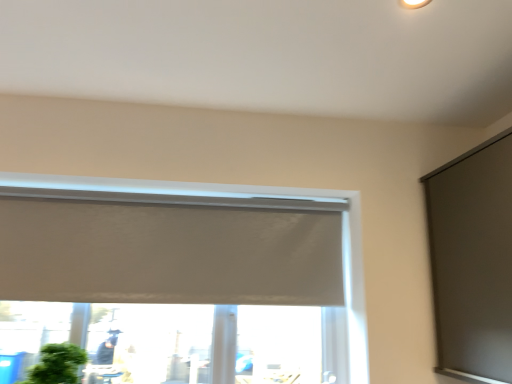
This screenshot has width=512, height=384. Identify the location of green matte houseplant at lower left. (57, 364).

The width and height of the screenshot is (512, 384). What do you see at coordinates (473, 261) in the screenshot?
I see `matte gray screen at right` at bounding box center [473, 261].

Locate an element on the screen. Image resolution: width=512 pixels, height=384 pixels. matte gray screen at right is located at coordinates (473, 261).

This screenshot has width=512, height=384. What are the coordinates of `green matte houseplant at lower left` in the screenshot? It's located at (57, 364).

From a real-world perspective, is matte gray screen at right on green matte houseplant at lower left?

Yes, from a real-world perspective, matte gray screen at right is on top of green matte houseplant at lower left.

Is there a large distance between matte gray screen at right and green matte houseplant at lower left?

Absolutely, matte gray screen at right is distant from green matte houseplant at lower left.

There is a green matte houseplant at lower left. Where is `window screen above it (from a real-world perspective)`? Image resolution: width=512 pixels, height=384 pixels. window screen above it (from a real-world perspective) is located at coordinates (473, 261).

From the image's perspective, is matte gray screen at right below green matte houseplant at lower left?

No, from the image's perspective, matte gray screen at right is not beneath green matte houseplant at lower left.

Which is farther, (52, 371) or (347, 251)?

The point (347, 251) is behind.

Is green matte houseplant at lower left looking in the opposite direction of white matte window at center?

Absolutely, green matte houseplant at lower left is directed away from white matte window at center.

Is green matte houseplant at lower left with white matte window at center?

No, green matte houseplant at lower left is not next to white matte window at center.

Is green matte houseplant at lower left taller than white matte window at center?

No.

Is green matte houseplant at lower left next to matte gray screen at right?

No, green matte houseplant at lower left is not making contact with matte gray screen at right.

Can you confirm if green matte houseplant at lower left is thinner than matte gray screen at right?

Yes, green matte houseplant at lower left is thinner than matte gray screen at right.

Is green matte houseplant at lower left oriented towards matte gray screen at right?

No, green matte houseplant at lower left is not turned towards matte gray screen at right.

How many degrees apart are the facing directions of matte gray screen at right and white matte window at center?

The angle between the facing direction of matte gray screen at right and the facing direction of white matte window at center is 91.5 degrees.

Which is behind, matte gray screen at right or white matte window at center?

white matte window at center is further from the camera.

Which object is positioned more to the right, matte gray screen at right or white matte window at center?

From the viewer's perspective, matte gray screen at right appears more on the right side.

From the image's perspective, is matte gray screen at right below white matte window at center?

Incorrect, from the image's perspective, matte gray screen at right is higher than white matte window at center.

Does white matte window at center come in front of matte gray screen at right?

No, it is not.

From a real-world perspective, who is located lower, white matte window at center or matte gray screen at right?

white matte window at center.

From the image's perspective, does white matte window at center appear higher than matte gray screen at right?

No.

I want to click on window located behind the green matte houseplant at lower left, so click(251, 196).

Looking at this image, which point is more forward, (9, 175) or (49, 370)?

The point (49, 370) is more forward.

Does white matte window at center lie behind green matte houseplant at lower left?

Yes, white matte window at center is behind green matte houseplant at lower left.

Is white matte window at center bigger or smaller than green matte houseplant at lower left?

Considering their sizes, white matte window at center takes up more space than green matte houseplant at lower left.

Where is `window screen above the green matte houseplant at lower left (from a real-world perspective)`? This screenshot has width=512, height=384. window screen above the green matte houseplant at lower left (from a real-world perspective) is located at coordinates (473, 261).

Where is `houseplant lying in front of the white matte window at center`? The height and width of the screenshot is (384, 512). houseplant lying in front of the white matte window at center is located at coordinates (x=57, y=364).

From the image, which object appears to be farther from matte gray screen at right, white matte window at center or green matte houseplant at lower left?

Based on the image, green matte houseplant at lower left appears to be further to matte gray screen at right.

Looking at this image, from the image, which object appears to be nearer to green matte houseplant at lower left, matte gray screen at right or white matte window at center?

Among the two, white matte window at center is located nearer to green matte houseplant at lower left.

Estimate the real-world distances between objects in this image. Which object is closer to matte gray screen at right, green matte houseplant at lower left or white matte window at center?

Among the two, white matte window at center is located nearer to matte gray screen at right.

Looking at the image, which one is located further to white matte window at center, matte gray screen at right or green matte houseplant at lower left?

green matte houseplant at lower left is further to white matte window at center.

When comparing their distances from white matte window at center, does green matte houseplant at lower left or matte gray screen at right seem closer?

Among the two, matte gray screen at right is located nearer to white matte window at center.

Considering their positions, is white matte window at center positioned further to green matte houseplant at lower left than matte gray screen at right?

matte gray screen at right is positioned further to the anchor green matte houseplant at lower left.

Find the location of a particular element. This screenshot has width=512, height=384. window situated between green matte houseplant at lower left and matte gray screen at right from left to right is located at coordinates (251, 196).